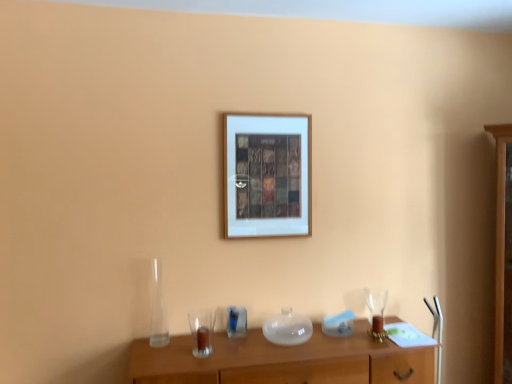
Question: Does point (159, 314) appear closer or farther from the camera than point (380, 327)?

Choices:
 (A) closer
 (B) farther

Answer: (A)

Question: Would you say transparent glass vase at lower left is to the left or to the right of clear glass wine glass at right in the picture?

Choices:
 (A) right
 (B) left

Answer: (B)

Question: Which of these objects is positioned closest to the transparent glass vase at lower left?

Choices:
 (A) wooden table at center
 (B) white matte picture frame at center
 (C) clear glass wine glass at right

Answer: (A)

Question: Which object is the closest to the wooden table at center?

Choices:
 (A) clear glass wine glass at right
 (B) white matte picture frame at center
 (C) transparent glass vase at lower left

Answer: (A)